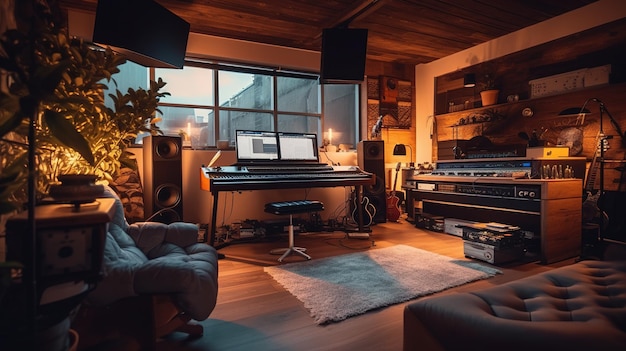
Locate an element on the screen. The height and width of the screenshot is (351, 626). chair is located at coordinates (141, 260).